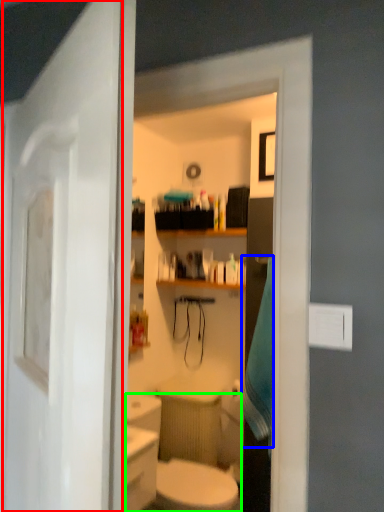
Question: Based on their relative distances, which object is nearer to door (highlighted by a red box)? Choose from bath towel (highlighted by a blue box) and sink (highlighted by a green box).

Choices:
 (A) bath towel
 (B) sink

Answer: (B)